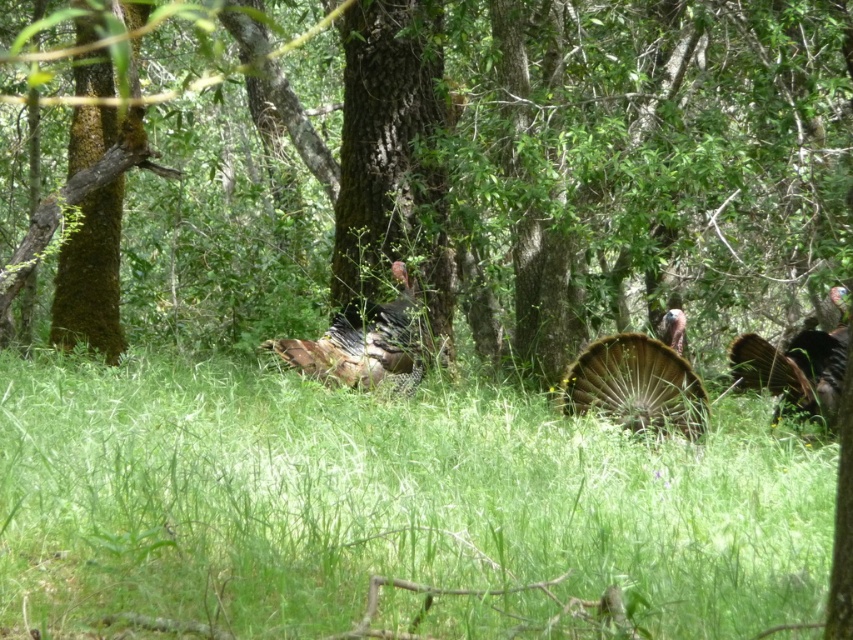
Who is shorter, green mossy tree at center or brown speckled feathers at center?

green mossy tree at center is shorter.

Between point (502, 54) and point (343, 358), which one is positioned in front?

Positioned in front is point (343, 358).

Is point (376, 202) closer to camera compared to point (393, 356)?

No.

At what (x,y) coordinates should I click in order to perform the action: click on green mossy tree at center. Please return your answer as a coordinate pair (x, y). Looking at the image, I should click on (598, 157).

Based on the photo, is brown textured feathers at center thinner than feathered brown turkey at right?

Indeed, brown textured feathers at center has a lesser width compared to feathered brown turkey at right.

Is brown textured feathers at center smaller than feathered brown turkey at right?

Correct, brown textured feathers at center occupies less space than feathered brown turkey at right.

The image size is (853, 640). Identify the location of brown textured feathers at center. (636, 385).

Does green grassy at center appear on the right side of brown feathered turkey at center?

No, green grassy at center is not to the right of brown feathered turkey at center.

Which is more to the right, green grassy at center or brown feathered turkey at center?

brown feathered turkey at center is more to the right.

The height and width of the screenshot is (640, 853). Identify the location of green grassy at center. (384, 500).